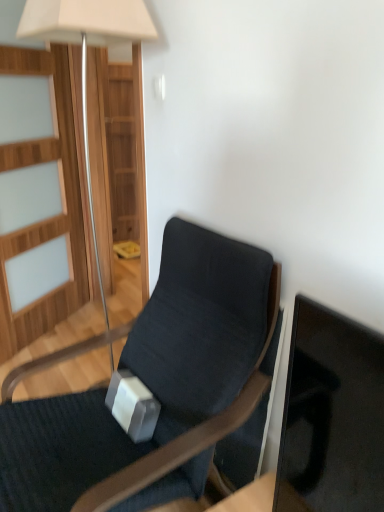
Identify the location of matte white lamp at upper left. The height and width of the screenshot is (512, 384). (86, 50).

This screenshot has width=384, height=512. What do you see at coordinates (86, 50) in the screenshot?
I see `matte white lamp at upper left` at bounding box center [86, 50].

Image resolution: width=384 pixels, height=512 pixels. What do you see at coordinates (152, 386) in the screenshot? I see `dark fabric chair at center` at bounding box center [152, 386].

Where is `dark fabric chair at center`? dark fabric chair at center is located at coordinates (152, 386).

I want to click on matte white lamp at upper left, so click(x=86, y=50).

Between dark fabric chair at center and matte white lamp at upper left, which one appears on the right side from the viewer's perspective?

Positioned to the right is dark fabric chair at center.

Relative to matte white lamp at upper left, is dark fabric chair at center in front or behind?

Visually, dark fabric chair at center is located in front of matte white lamp at upper left.

Is point (2, 475) more distant than point (146, 11)?

That is False.

From the image's perspective, does dark fabric chair at center appear higher than matte white lamp at upper left?

No, from the image's perspective, dark fabric chair at center is not above matte white lamp at upper left.

From a real-world perspective, is dark fabric chair at center under matte white lamp at upper left?

Indeed, from a real-world perspective, dark fabric chair at center is positioned beneath matte white lamp at upper left.

Which object is wider, dark fabric chair at center or matte white lamp at upper left?

Wider between the two is dark fabric chair at center.

Between dark fabric chair at center and matte white lamp at upper left, which one has less height?

dark fabric chair at center.

Is dark fabric chair at center bigger or smaller than matte white lamp at upper left?

dark fabric chair at center is bigger than matte white lamp at upper left.

Is dark fabric chair at center not inside matte white lamp at upper left?

Yes, dark fabric chair at center is located beyond the bounds of matte white lamp at upper left.

Is dark fabric chair at center with matte white lamp at upper left?

No, dark fabric chair at center is not touching matte white lamp at upper left.

Is dark fabric chair at center turned away from matte white lamp at upper left?

No, dark fabric chair at center is not facing the opposite direction of matte white lamp at upper left.

How different are the orientations of dark fabric chair at center and matte white lamp at upper left in degrees?

The angular difference between dark fabric chair at center and matte white lamp at upper left is 0.113 degrees.

How far apart are dark fabric chair at center and matte white lamp at upper left?

dark fabric chair at center and matte white lamp at upper left are 1.07 meters apart.

Find the location of a particular element. lamp behind the dark fabric chair at center is located at coordinates point(86,50).

Is matte white lamp at upper left at the left side of dark fabric chair at center?

Yes.

Based on the photo, which is in front, matte white lamp at upper left or dark fabric chair at center?

dark fabric chair at center is in front.

Is point (127, 27) farther from camera compared to point (197, 490)?

Yes.

From the image's perspective, does matte white lamp at upper left appear higher than dark fabric chair at center?

Yes.

From a real-world perspective, which is physically below, matte white lamp at upper left or dark fabric chair at center?

dark fabric chair at center, from a real-world perspective.

Is matte white lamp at upper left wider than dark fabric chair at center?

In fact, matte white lamp at upper left might be narrower than dark fabric chair at center.

Can you confirm if matte white lamp at upper left is taller than dark fabric chair at center?

Correct, matte white lamp at upper left is much taller as dark fabric chair at center.

Considering the sizes of objects matte white lamp at upper left and dark fabric chair at center in the image provided, who is bigger, matte white lamp at upper left or dark fabric chair at center?

With larger size is dark fabric chair at center.

Is dark fabric chair at center inside matte white lamp at upper left?

That's incorrect, dark fabric chair at center is not inside matte white lamp at upper left.

Are matte white lamp at upper left and dark fabric chair at center far apart?

matte white lamp at upper left is far away from dark fabric chair at center.

Is matte white lamp at upper left facing towards dark fabric chair at center?

No, matte white lamp at upper left is not turned towards dark fabric chair at center.

What's the angular difference between matte white lamp at upper left and dark fabric chair at center's facing directions?

There is a 0.113-degree angle between the facing directions of matte white lamp at upper left and dark fabric chair at center.

How far apart are matte white lamp at upper left and dark fabric chair at center?

3.52 feet.

Find the location of a particular element. The width and height of the screenshot is (384, 512). chair located below the matte white lamp at upper left (from the image's perspective) is located at coordinates (152, 386).

At what (x,y) coordinates should I click in order to perform the action: click on lamp behind the dark fabric chair at center. Please return your answer as a coordinate pair (x, y). The image size is (384, 512). Looking at the image, I should click on (86, 50).

Locate an element on the screen. Image resolution: width=384 pixels, height=512 pixels. lamp above the dark fabric chair at center (from the image's perspective) is located at coordinates (86, 50).